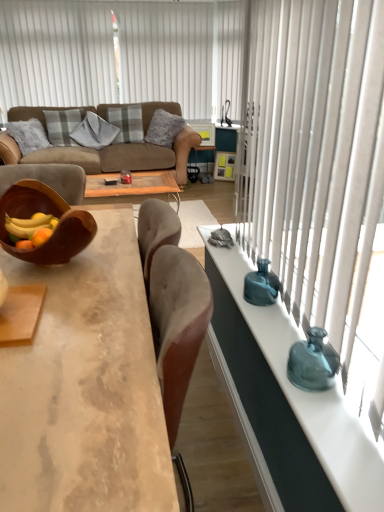
Image resolution: width=384 pixels, height=512 pixels. What are the coordinates of `vacant space in front of teal glass vase at right, the second vase from the bottom` in the screenshot? It's located at (271, 322).